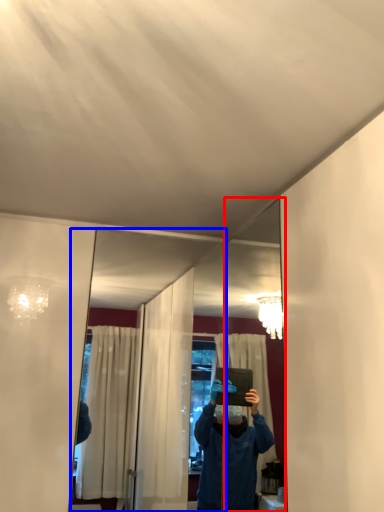
Question: Among these objects, which one is nearest to the camera, mirror (highlighted by a red box) or mirror (highlighted by a blue box)?

Choices:
 (A) mirror
 (B) mirror

Answer: (A)